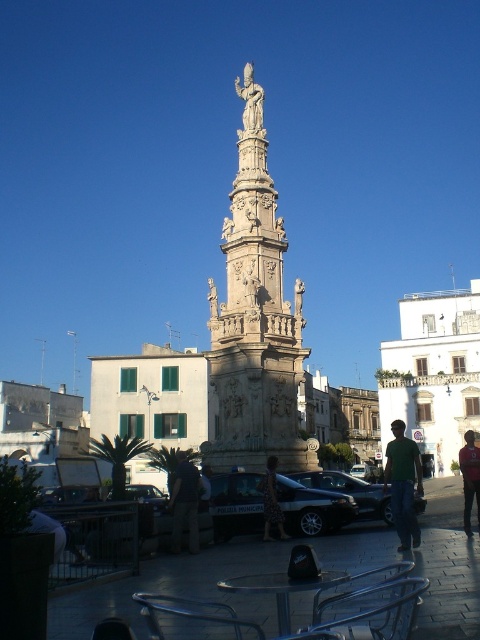
Does dark blue jeans at center appear under metallic silver car at center?

Actually, dark blue jeans at center is above metallic silver car at center.

Which of these two, dark blue jeans at center or metallic silver car at center, stands taller?

metallic silver car at center is taller.

Describe the element at coordinates (184, 502) in the screenshot. The height and width of the screenshot is (640, 480). I see `dark blue jeans at center` at that location.

The height and width of the screenshot is (640, 480). In order to click on dark blue jeans at center in this screenshot , I will do `click(184, 502)`.

Can you confirm if dark gray metallic car at center is positioned to the right of dark red fabric jacket at center?

No, dark gray metallic car at center is not to the right of dark red fabric jacket at center.

Measure the distance between dark gray metallic car at center and dark red fabric jacket at center.

dark gray metallic car at center and dark red fabric jacket at center are 16.20 meters apart.

Does point (336, 508) lie behind point (475, 474)?

No.

This screenshot has height=640, width=480. I want to click on dark gray metallic car at center, so click(x=312, y=508).

The height and width of the screenshot is (640, 480). Identify the location of green matte shirt at center. (403, 484).

Is point (399, 534) farther from viewer compared to point (274, 460)?

That is False.

Between point (397, 460) and point (268, 497), which one is positioned behind?

The point (397, 460) is more distant.

Identify the location of green matte shirt at center. The image size is (480, 640). click(403, 484).